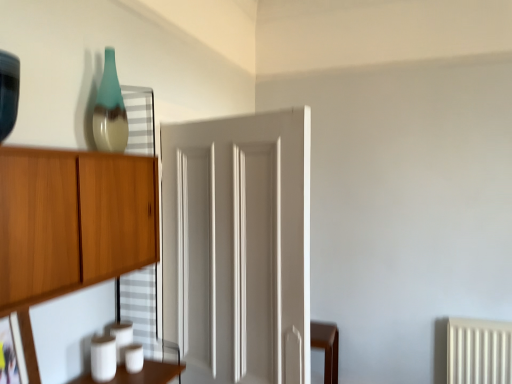
Question: Is matte black picture frame at lower left oriented towards white painted wood door at center?

Choices:
 (A) no
 (B) yes

Answer: (A)

Question: Is matte black picture frame at lower left touching white painted wood door at center?

Choices:
 (A) yes
 (B) no

Answer: (B)

Question: Is matte black picture frame at lower left taller than white painted wood door at center?

Choices:
 (A) no
 (B) yes

Answer: (A)

Question: Is matte black picture frame at lower left closer to the viewer compared to white painted wood door at center?

Choices:
 (A) no
 (B) yes

Answer: (B)

Question: Does matte black picture frame at lower left appear on the right side of white painted wood door at center?

Choices:
 (A) no
 (B) yes

Answer: (A)

Question: Considering their positions, is white painted wood door at center located in front of or behind teal glass vase at upper left?

Choices:
 (A) front
 (B) behind

Answer: (A)

Question: Looking at their shapes, would you say white painted wood door at center is wider or thinner than teal glass vase at upper left?

Choices:
 (A) wide
 (B) thin

Answer: (A)

Question: From the image's perspective, is white painted wood door at center above or below teal glass vase at upper left?

Choices:
 (A) above
 (B) below

Answer: (B)

Question: Is white painted wood door at center to the left or to the right of teal glass vase at upper left in the image?

Choices:
 (A) left
 (B) right

Answer: (B)

Question: Does point (242, 122) appear closer or farther from the camera than point (6, 375)?

Choices:
 (A) closer
 (B) farther

Answer: (B)

Question: Is white painted wood door at center wider or thinner than matte black picture frame at lower left?

Choices:
 (A) thin
 (B) wide

Answer: (B)

Question: Is white painted wood door at center inside or outside of matte black picture frame at lower left?

Choices:
 (A) inside
 (B) outside

Answer: (B)

Question: Based on their sizes in the image, would you say white painted wood door at center is bigger or smaller than matte black picture frame at lower left?

Choices:
 (A) small
 (B) big

Answer: (B)

Question: In terms of size, does teal glass vase at upper left appear bigger or smaller than matte black picture frame at lower left?

Choices:
 (A) small
 (B) big

Answer: (B)

Question: Does point (108, 132) appear closer or farther from the camera than point (10, 321)?

Choices:
 (A) farther
 (B) closer

Answer: (A)